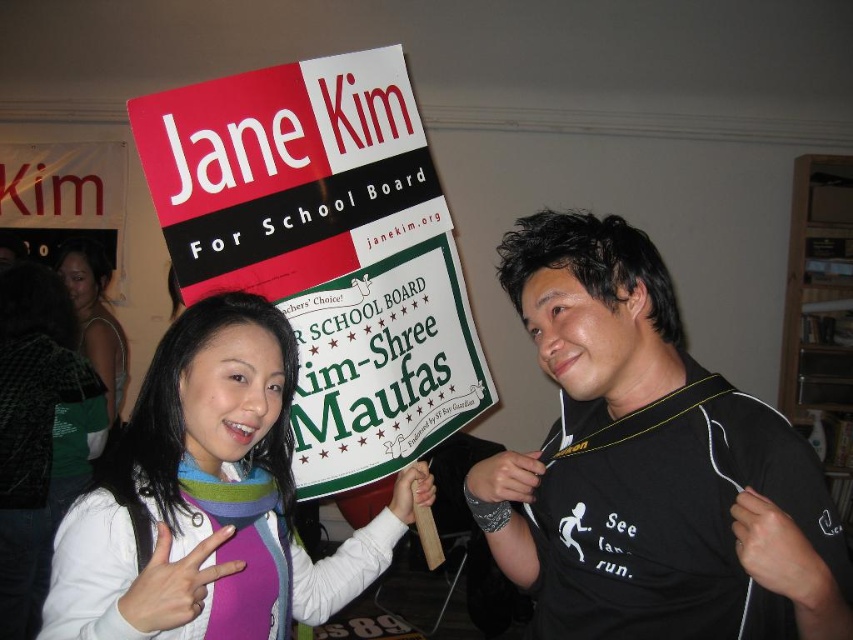
Where is the black matte shirt at center located in the image?

The black matte shirt at center is located at point (650, 465).

You are a photographer trying to capture a clear shot of the black matte shirt at center and the red plastic sign at upper center. Which object should you focus on first if you want to ensure both are in focus without adjusting the camera settings?

The black matte shirt at center is shorter than the red plastic sign at upper center, so you should focus on the red plastic sign at upper center first since it is farther away. This way, the depth of field will cover both objects more effectively.